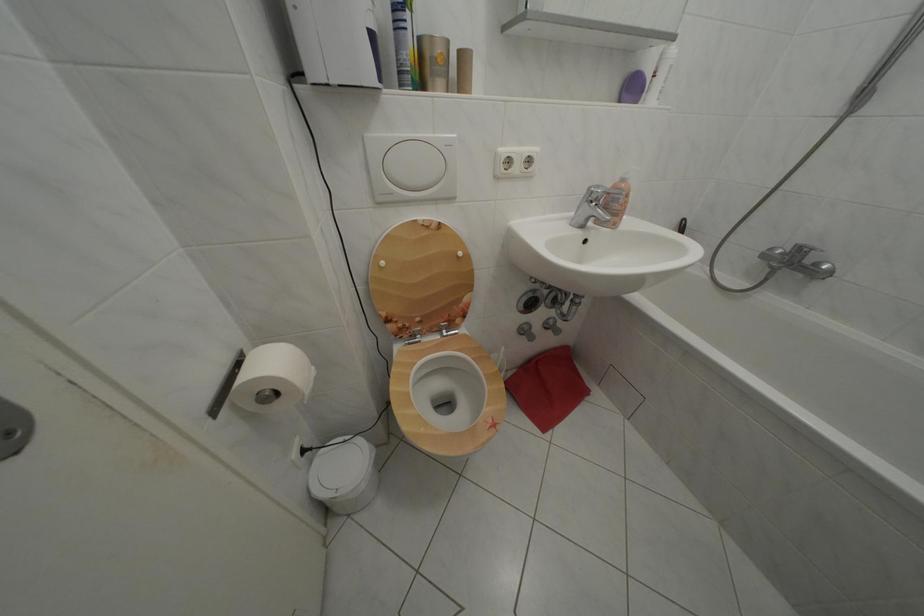
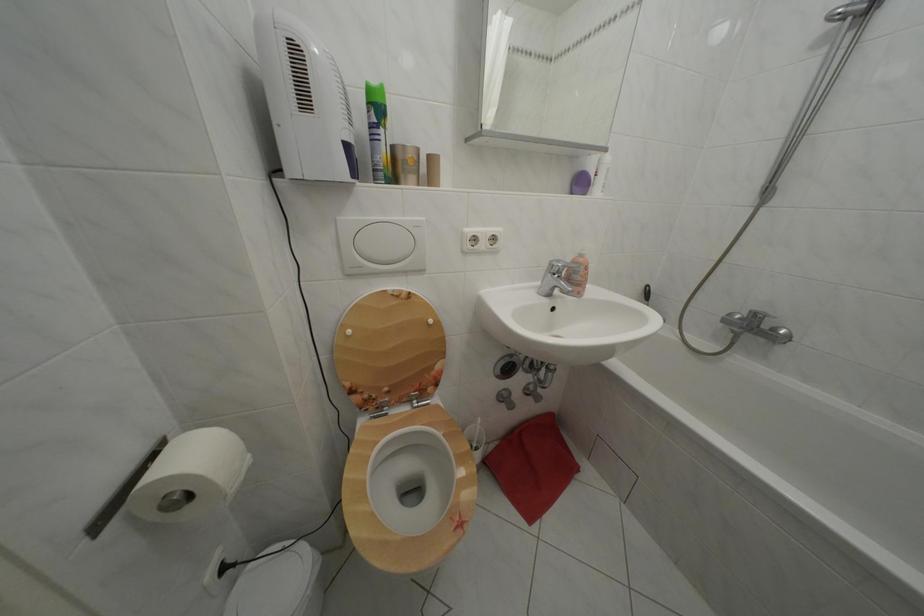
In the second image, find the point that corresponds to pixel 608 193 in the first image.

(567, 268)